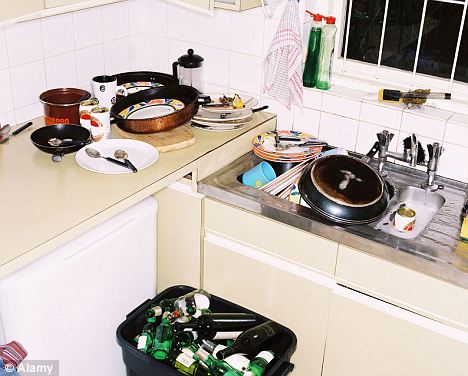
I want to click on spoon, so click(x=120, y=152), click(x=94, y=153).